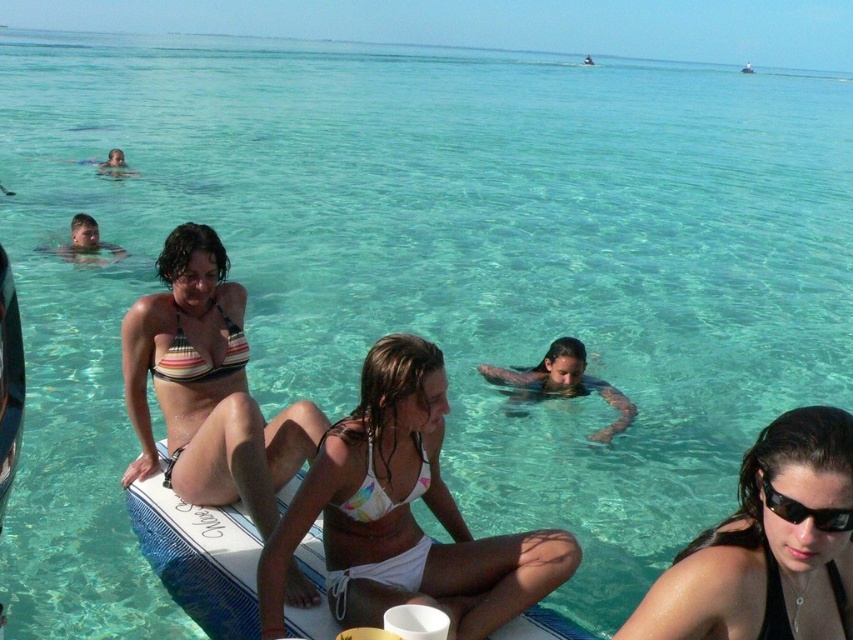
You are a photographer trying to capture a clear shot of the white bikini at center and the black plastic sunglasses at lower right. Which object should you focus on first if you want to ensure both are in focus without adjusting the camera settings?

The white bikini at center is taller than the black plastic sunglasses at lower right. Since depth of field is typically better for objects closer to the camera, focusing on the taller object first might help maintain focus on both. However, without knowing their distance from the camera, it is safer to focus on the closer object. But based on height alone, focusing on the white bikini at center first could be advantageous.

Consider the image. You are a photographer trying to capture the striped bikini top at center. Based on the coordinates point (207,387), where should you aim your camera to ensure the striped bikini top at center is in the frame?

The striped bikini top at center is located at point (207,387), so aim your camera towards that coordinate to ensure it is in the frame.